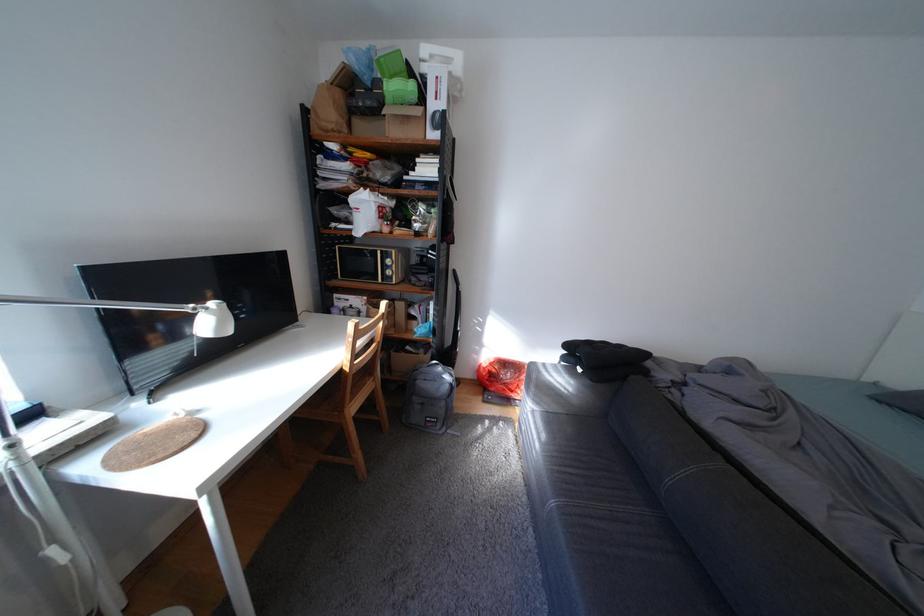
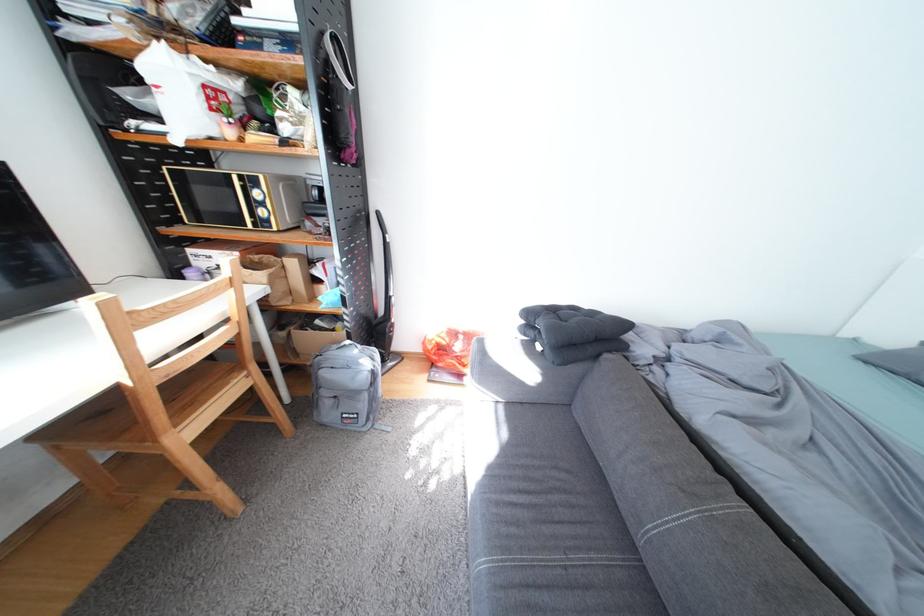
Question: The first image is from the beginning of the video and the second image is from the end. How did the camera likely rotate when shooting the video?

Choices:
 (A) Left
 (B) Right
 (C) Up
 (D) Down

Answer: (D)